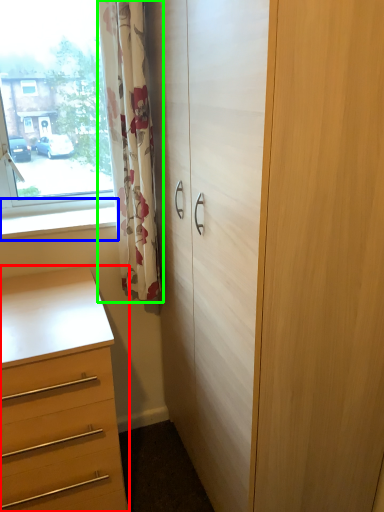
Question: Which object is the farthest from chest of drawers (highlighted by a red box)? Choose among these: window sill (highlighted by a blue box) or curtain (highlighted by a green box).

Choices:
 (A) window sill
 (B) curtain

Answer: (B)